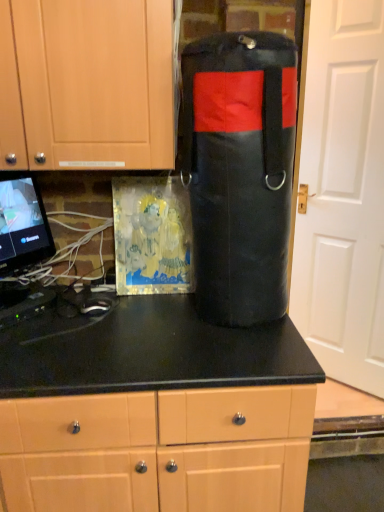
Identify the location of free spot in front of black leather punching bag at center. The width and height of the screenshot is (384, 512). (239, 355).